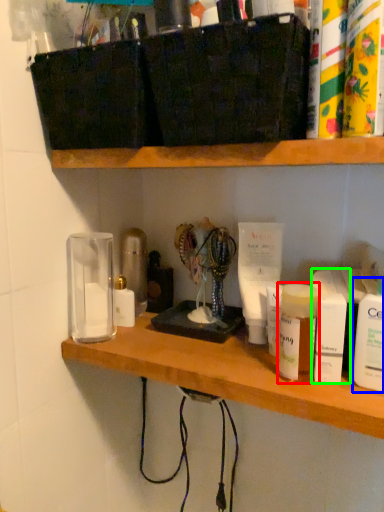
Question: Estimate the real-world distances between objects in this image. Which object is farther from toiletry (highlighted by a red box), toiletry (highlighted by a blue box) or toiletry (highlighted by a green box)?

Choices:
 (A) toiletry
 (B) toiletry

Answer: (A)